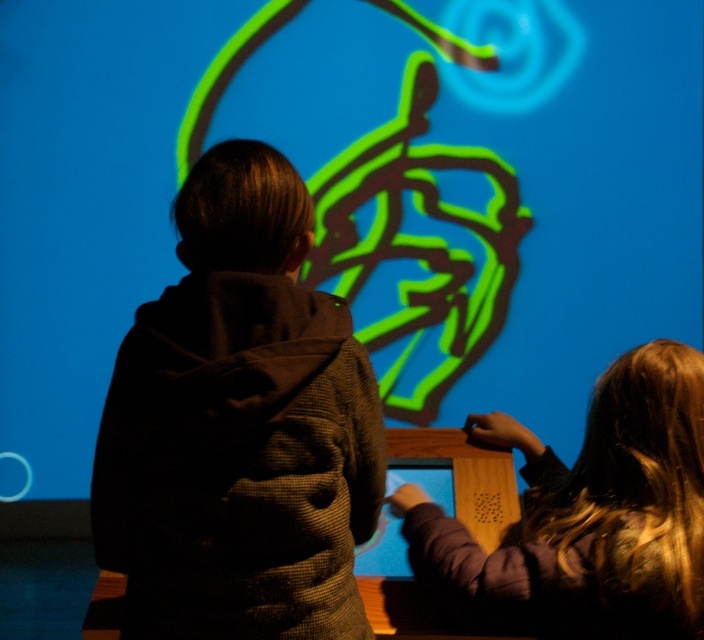
Looking at this image, does dark brown textured hoodie at center have a lesser width compared to smooth purple sweater at lower right?

Yes.

Does dark brown textured hoodie at center have a greater height compared to smooth purple sweater at lower right?

Yes.

Which is in front, point (284, 218) or point (667, 547)?

Point (284, 218) is more forward.

The image size is (704, 640). Identify the location of dark brown textured hoodie at center. (239, 426).